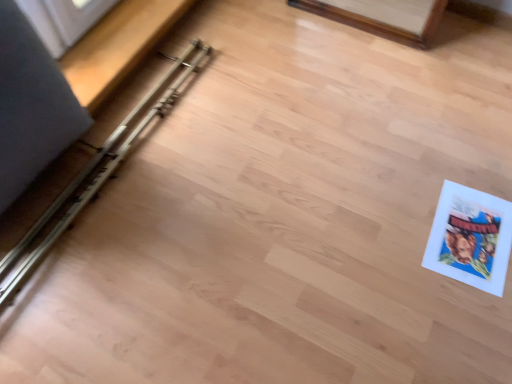
Image resolution: width=512 pixels, height=384 pixels. What do you see at coordinates (470, 238) in the screenshot?
I see `white paper comic book at lower right` at bounding box center [470, 238].

What is the approximate width of white paper comic book at lower right?

white paper comic book at lower right is 11.73 inches in width.

The width and height of the screenshot is (512, 384). Identify the location of white paper comic book at lower right. tap(470, 238).

What is the approximate height of white paper comic book at lower right?

0.79 inches.

What do you see at coordinates (93, 176) in the screenshot? The height and width of the screenshot is (384, 512). I see `metallic silver rail at left` at bounding box center [93, 176].

Locate an element on the screen. Image resolution: width=512 pixels, height=384 pixels. metallic silver rail at left is located at coordinates (93, 176).

Identify the location of white paper comic book at lower right. (470, 238).

Does white paper comic book at lower right appear on the right side of metallic silver rail at left?

Indeed, white paper comic book at lower right is positioned on the right side of metallic silver rail at left.

Relative to metallic silver rail at left, is white paper comic book at lower right in front or behind?

white paper comic book at lower right is behind metallic silver rail at left.

Which is nearer, [451,232] or [164,78]?

Point [451,232] is positioned closer to the camera compared to point [164,78].

From the image's perspective, is white paper comic book at lower right above or below metallic silver rail at left?

From the image's perspective, white paper comic book at lower right appears below metallic silver rail at left.

From a real-world perspective, who is located lower, white paper comic book at lower right or metallic silver rail at left?

From a 3D spatial view, white paper comic book at lower right is below.

In the scene shown: Which of these two, white paper comic book at lower right or metallic silver rail at left, is wider?

With larger width is metallic silver rail at left.

From the picture: Which of these two, white paper comic book at lower right or metallic silver rail at left, stands taller?

metallic silver rail at left is taller.

Who is bigger, white paper comic book at lower right or metallic silver rail at left?

metallic silver rail at left.

Could metallic silver rail at left be considered to be inside white paper comic book at lower right?

No, metallic silver rail at left is not inside white paper comic book at lower right.

Can you see white paper comic book at lower right touching metallic silver rail at left?

No, white paper comic book at lower right is not in contact with metallic silver rail at left.

Is white paper comic book at lower right facing towards metallic silver rail at left?

No, white paper comic book at lower right is not aimed at metallic silver rail at left.

How different are the orientations of white paper comic book at lower right and metallic silver rail at left in degrees?

3.29 degrees separate the facing orientations of white paper comic book at lower right and metallic silver rail at left.

I want to click on comic book beneath the metallic silver rail at left (from a real-world perspective), so click(470, 238).

Between metallic silver rail at left and white paper comic book at lower right, which one appears on the left side from the viewer's perspective?

metallic silver rail at left is more to the left.

Considering the positions of objects metallic silver rail at left and white paper comic book at lower right in the image provided, who is in front, metallic silver rail at left or white paper comic book at lower right?

Positioned in front is metallic silver rail at left.

Between point (4, 289) and point (450, 202), which one is positioned behind?

Positioned behind is point (450, 202).

From the image's perspective, who appears lower, metallic silver rail at left or white paper comic book at lower right?

white paper comic book at lower right, from the image's perspective.

From a real-world perspective, between metallic silver rail at left and white paper comic book at lower right, who is vertically lower?

white paper comic book at lower right is physically lower.

Is metallic silver rail at left wider or thinner than white paper comic book at lower right?

In the image, metallic silver rail at left appears to be wider than white paper comic book at lower right.

Consider the image. Considering the sizes of objects metallic silver rail at left and white paper comic book at lower right in the image provided, who is taller, metallic silver rail at left or white paper comic book at lower right?

Standing taller between the two is metallic silver rail at left.

Is metallic silver rail at left bigger or smaller than white paper comic book at lower right?

metallic silver rail at left is bigger than white paper comic book at lower right.

Would you say metallic silver rail at left is inside or outside white paper comic book at lower right?

metallic silver rail at left cannot be found inside white paper comic book at lower right.

Would you say metallic silver rail at left is a long distance from white paper comic book at lower right?

metallic silver rail at left is positioned a significant distance from white paper comic book at lower right.

Is metallic silver rail at left facing towards white paper comic book at lower right?

No, metallic silver rail at left is not aimed at white paper comic book at lower right.

How different are the orientations of metallic silver rail at left and white paper comic book at lower right in degrees?

They differ by 3.29 degrees in their facing directions.

What are the coordinates of `rail that appears above the white paper comic book at lower right (from a real-world perspective)` in the screenshot? It's located at (93, 176).

I want to click on comic book located on the right of metallic silver rail at left, so click(x=470, y=238).

Locate an element on the screen. The image size is (512, 384). comic book behind the metallic silver rail at left is located at coordinates click(470, 238).